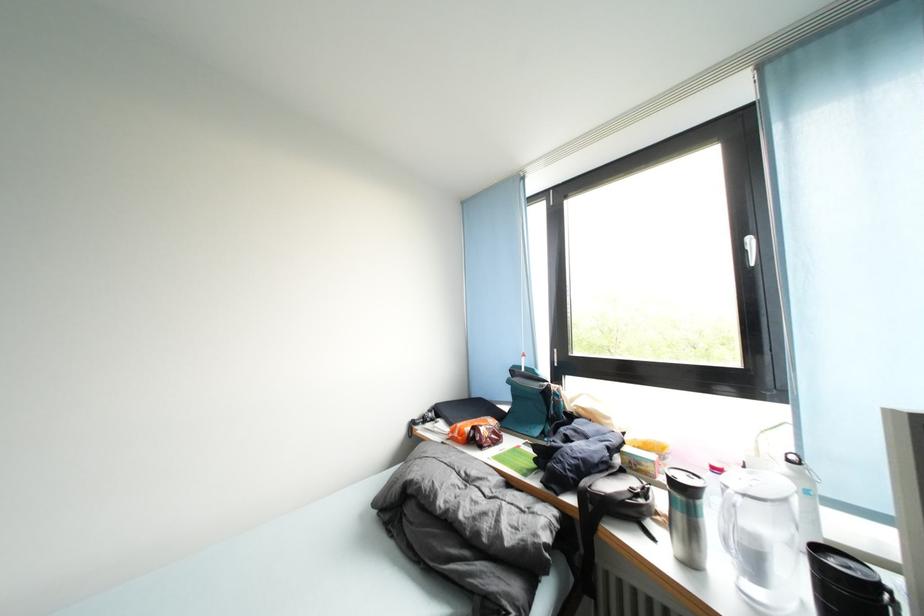
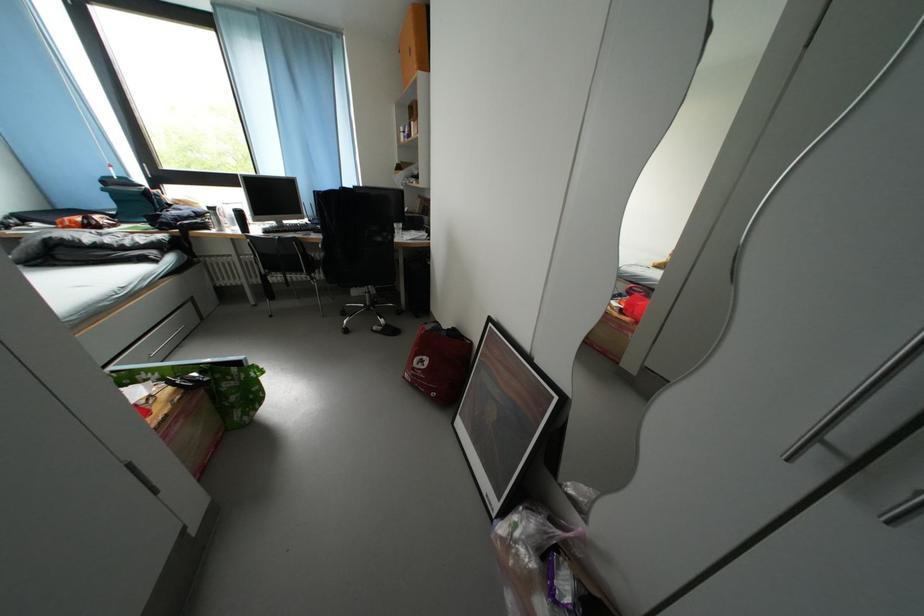
Question: I am providing you with two images of the same scene from different viewpoints. After the viewpoint changes to image2, which objects are now occluded?

Choices:
 (A) chair sitting surface
 (B) metal drawer handle
 (C) blue door hanger
 (D) backpack top handle

Answer: (D)